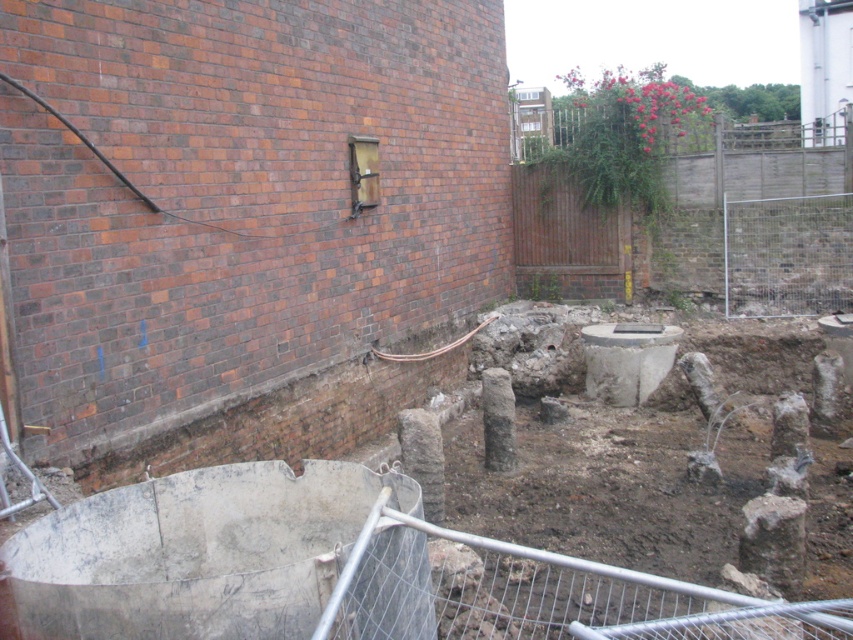
Can you confirm if brown wooden fence at upper right is wider than metal wire mesh at lower center?

Indeed, brown wooden fence at upper right has a greater width compared to metal wire mesh at lower center.

Does brown wooden fence at upper right have a lesser height compared to metal wire mesh at lower center?

Incorrect, brown wooden fence at upper right's height does not fall short of metal wire mesh at lower center's.

The height and width of the screenshot is (640, 853). What are the coordinates of `brown wooden fence at upper right` in the screenshot? It's located at (759, 221).

Image resolution: width=853 pixels, height=640 pixels. I want to click on brown wooden fence at upper right, so click(759, 221).

Is metal wire mesh at lower center smaller than smooth concrete hole at center?

No, metal wire mesh at lower center is not smaller than smooth concrete hole at center.

Does point (482, 538) lie behind point (616, 326)?

No, (482, 538) is in front of (616, 326).

At what (x,y) coordinates should I click in order to perform the action: click on metal wire mesh at lower center. Please return your answer as a coordinate pair (x, y). Image resolution: width=853 pixels, height=640 pixels. Looking at the image, I should click on (532, 593).

Does point (521, 220) come behind point (621, 324)?

Yes, point (521, 220) is behind point (621, 324).

Which is below, brown wooden fence at upper right or smooth concrete hole at center?

Positioned lower is smooth concrete hole at center.

I want to click on brown wooden fence at upper right, so click(x=759, y=221).